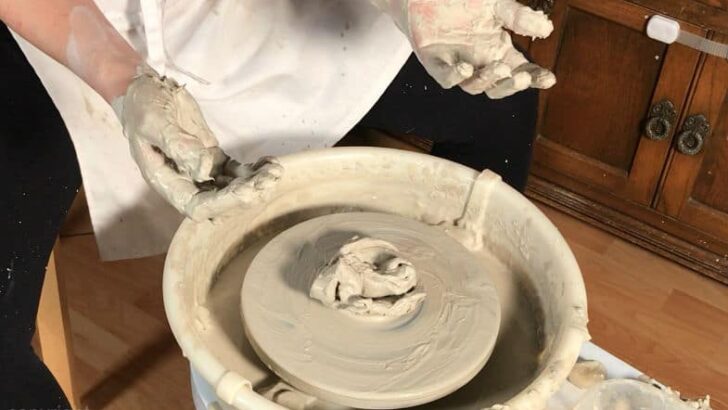
Find the location of a particular element. handle is located at coordinates (660, 123), (696, 147).